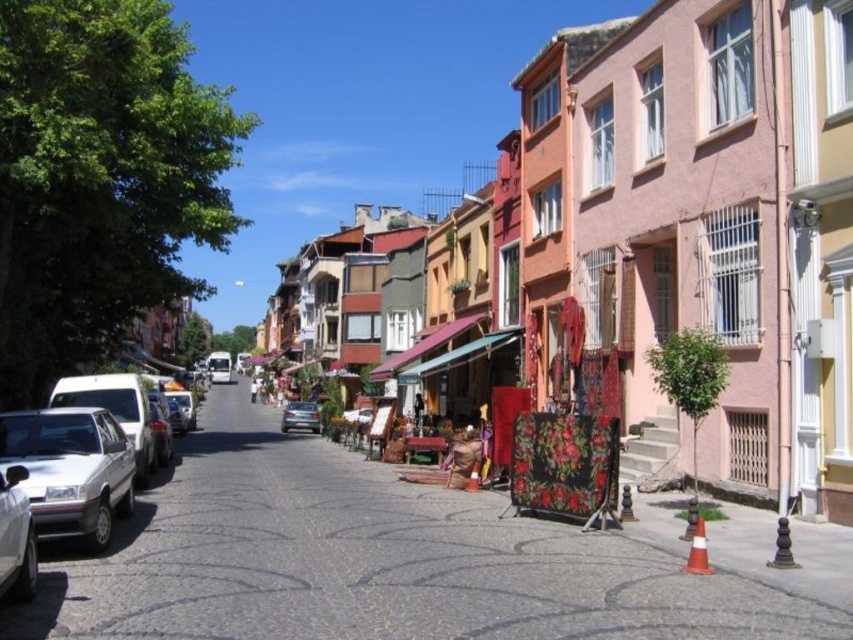
You are a delivery driver who needs to park your 1.8 meter wide van in this street. Looking at the silver metallic car at lower left and the satin silver sedan at center, which vehicle has a width that would allow your van to fit between them?

The silver metallic car at lower left has a smaller width than the satin silver sedan at center. Since your van is 1.8 meters wide, you should check the space between the silver metallic car at lower left and the building, as the space between the two cars might be too narrow.

You are standing at the point with coordinates point (x=453, y=364) and want to walk to the point with coordinates point (x=48, y=403). Which direction should you move to reach your destination?

You should move forward because point (x=48, y=403) is in front of point (x=453, y=364).